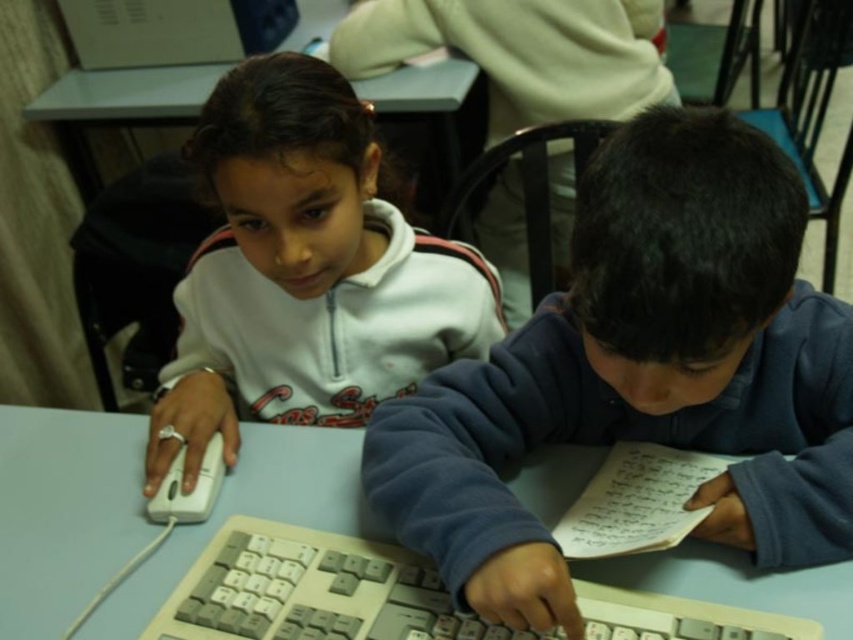
You are a teacher observing the classroom scene. You need to determine which object is larger between the white plastic computer at upper left and the white matte mouse at lower left. Based on the scene, which one is bigger?

The white plastic computer at upper left is bigger than the white matte mouse at lower left.

You are standing in the classroom and want to reach the point at coordinates point (766, 508). If your arm can extend 60 centimeters, can you reach it?

The point (766, 508) is 71.48 centimeters away from the viewer. Since your arm can only extend 60 centimeters, you cannot reach it.

You are standing in the classroom and want to move from the point at coordinates point [592,220] to the point at coordinates point [225,544]. Which direction should you move to reach your destination?

To move from point [592,220] to point [225,544], you should move towards the right and downward since the destination point is located to the right and lower than the starting point.